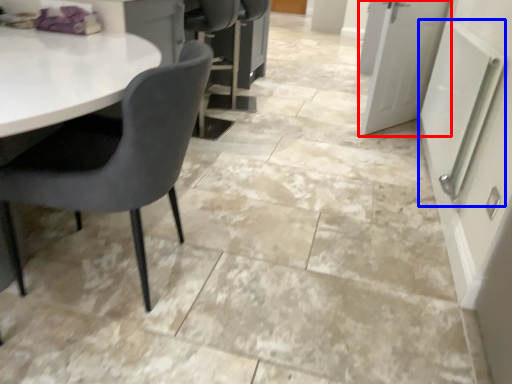
Question: Which point is further to the camera, door (highlighted by a red box) or radiator (highlighted by a blue box)?

Choices:
 (A) door
 (B) radiator

Answer: (A)